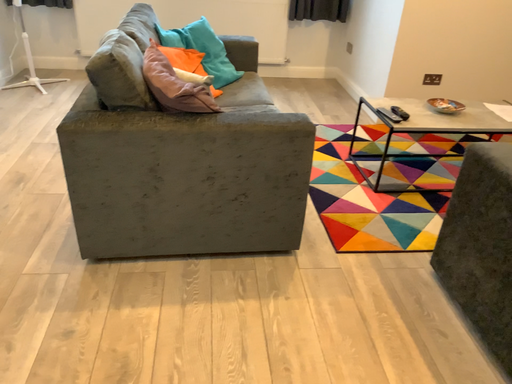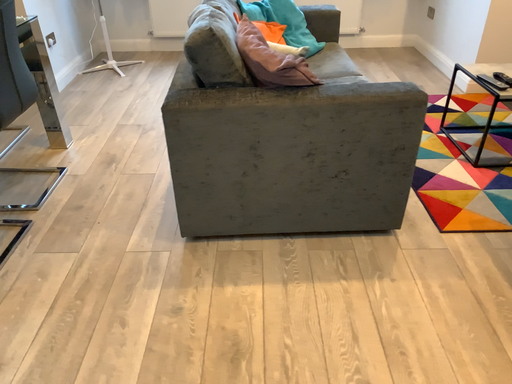
Question: How did the camera likely rotate when shooting the video?

Choices:
 (A) rotated left
 (B) rotated right

Answer: (A)